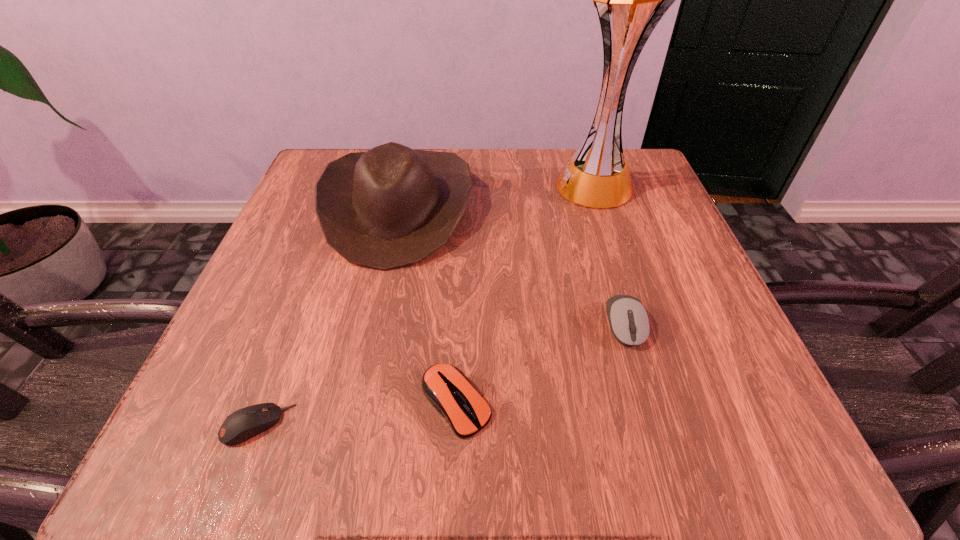
Identify the location of the tallest object. The height and width of the screenshot is (540, 960). (630, 0).

Find the location of a particular element. The height and width of the screenshot is (540, 960). cowboy hat is located at coordinates (392, 206).

Locate an element on the screen. This screenshot has height=540, width=960. the rightmost computer mouse is located at coordinates (628, 319).

Locate an element on the screen. This screenshot has width=960, height=540. the farthest computer mouse is located at coordinates (628, 319).

Locate an element on the screen. the second tallest computer mouse is located at coordinates (446, 387).

Where is `the second computer mouse from left to right`? the second computer mouse from left to right is located at coordinates (446, 387).

The height and width of the screenshot is (540, 960). In order to click on the leftmost computer mouse in this screenshot , I will do `click(243, 424)`.

Image resolution: width=960 pixels, height=540 pixels. What are the coordinates of `the shortest object` in the screenshot? It's located at (243, 424).

The width and height of the screenshot is (960, 540). I want to click on vacant area situated on the front-facing side of the tallest object, so click(399, 186).

Find the location of a particular element. This screenshot has width=960, height=540. free space located on the front-facing side of the tallest object is located at coordinates (464, 186).